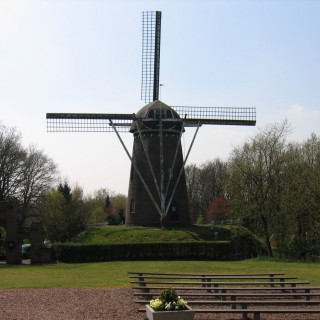
Identify the location of planter. click(x=179, y=317).